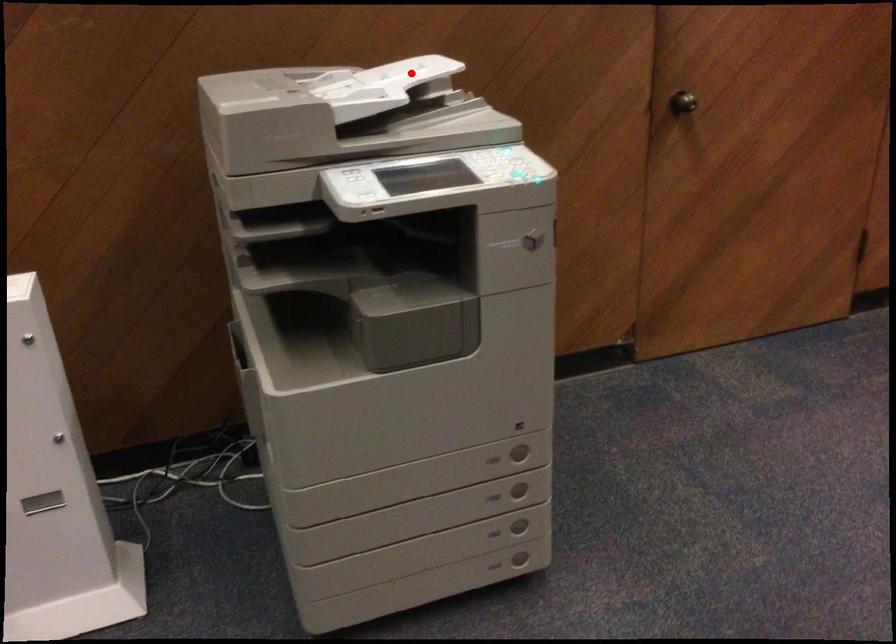
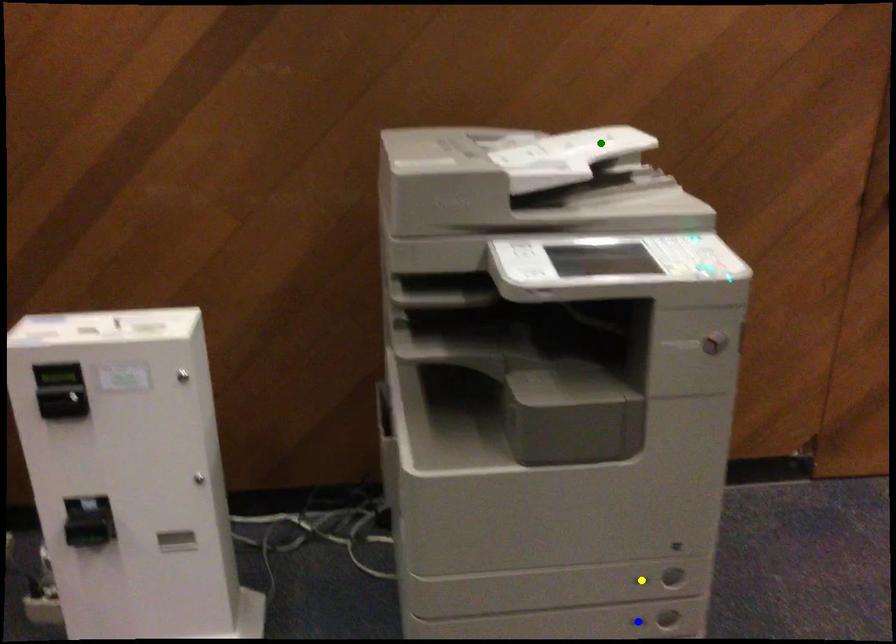
Question: I am providing you with two images of the same scene from different viewpoints. A red point is marked on the first image. You are given multiple points on the second image. Can you choose the point in image 2 that corresponds to the point in image 1?

Choices:
 (A) blue point
 (B) green point
 (C) yellow point

Answer: (B)